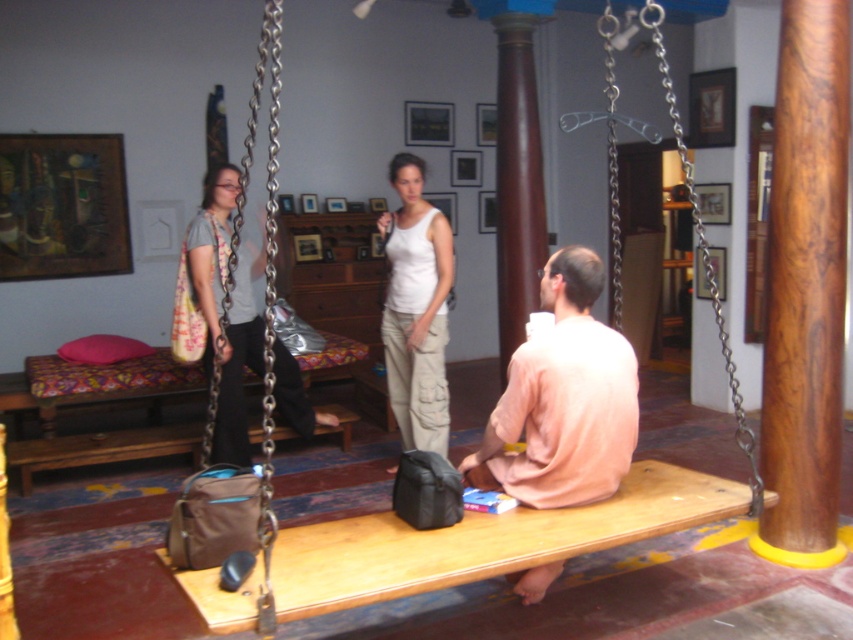
Question: Does wooden swing at center have a lesser width compared to matte gray shirt at left?

Choices:
 (A) yes
 (B) no

Answer: (B)

Question: Among these objects, which one is farthest from the camera?

Choices:
 (A) light pink cotton shirt at center
 (B) white cotton tank top at center

Answer: (B)

Question: Can you confirm if wooden swing at center is thinner than white cotton tank top at center?

Choices:
 (A) no
 (B) yes

Answer: (A)

Question: Which object is positioned closest to the brown wood pole at center?

Choices:
 (A) white cotton tank top at center
 (B) wooden swing at center
 (C) matte gray shirt at left
 (D) light pink cotton shirt at center

Answer: (D)

Question: Which of the following is the closest to the observer?

Choices:
 (A) (421, 368)
 (B) (218, 326)
 (C) (271, 544)

Answer: (C)

Question: Is wooden swing at center to the right of light pink cotton shirt at center from the viewer's perspective?

Choices:
 (A) yes
 (B) no

Answer: (B)